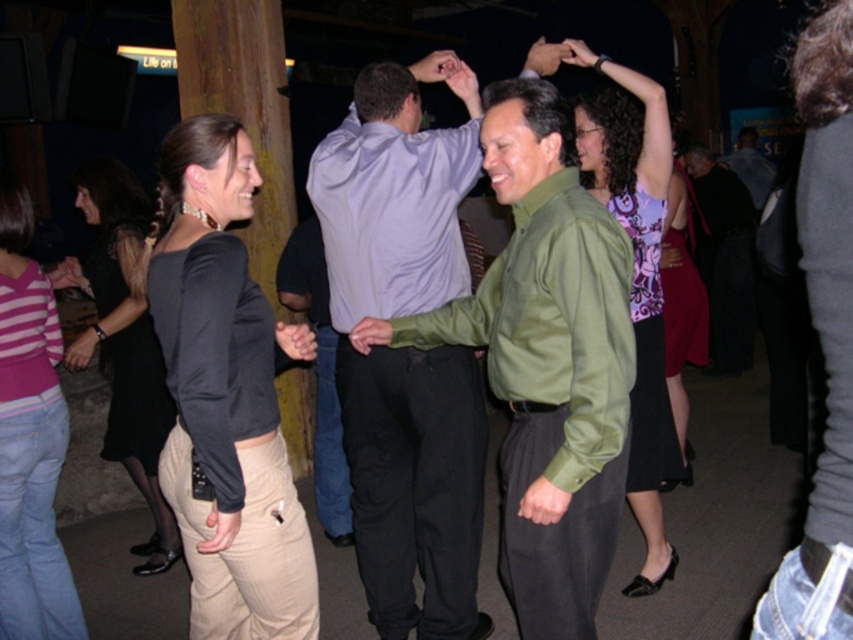
Who is lower down, green shiny shirt at center or khaki pants at lower left?

khaki pants at lower left is below.

Measure the distance between green shiny shirt at center and camera.

The distance of green shiny shirt at center from camera is 6.20 feet.

Is point (495, 115) closer to camera compared to point (190, 509)?

That is False.

The image size is (853, 640). In order to click on green shiny shirt at center in this screenshot , I will do `click(546, 362)`.

Does point (201, 369) lie behind point (309, 291)?

No, it is in front of (309, 291).

Is the position of khaki pants at lower left more distant than that of light purple satin shirt at center?

That is False.

Is point (252, 467) positioned before point (320, 272)?

Yes, point (252, 467) is closer to viewer.

This screenshot has width=853, height=640. I want to click on khaki pants at lower left, so click(x=225, y=396).

Is light purple shirt at center above printed silk blouse at upper right?

Incorrect, light purple shirt at center is not positioned above printed silk blouse at upper right.

You are a GUI agent. You are given a task and a screenshot of the screen. Output one action in this format:
    pyautogui.click(x=<x>, y=<y>)
    Task: Click on the light purple shirt at center
    
    Given the screenshot: What is the action you would take?
    pyautogui.click(x=405, y=349)